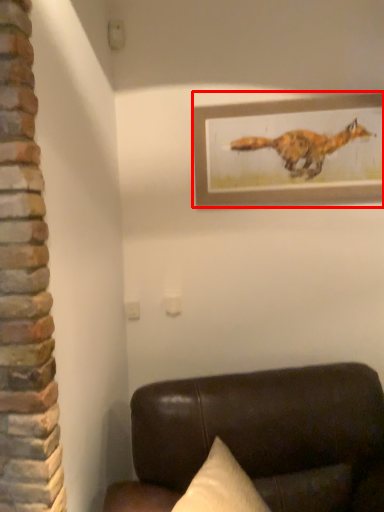
Question: From the image, what is the correct spatial relationship of picture frame (annotated by the red box) in relation to furniture?

Choices:
 (A) left
 (B) right

Answer: (B)